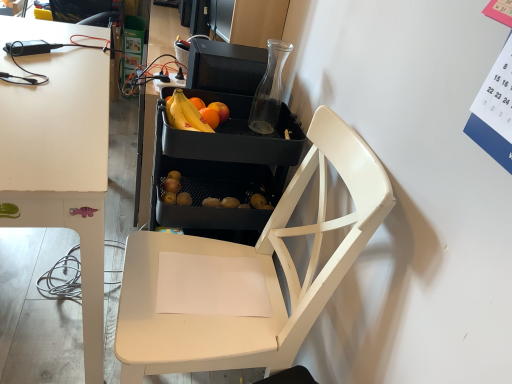
Describe the element at coordinates (223, 144) in the screenshot. This screenshot has width=512, height=384. I see `black plastic tray at center` at that location.

The image size is (512, 384). What do you see at coordinates (61, 167) in the screenshot?
I see `white matte desk at left` at bounding box center [61, 167].

What do you see at coordinates (192, 114) in the screenshot?
I see `matte black fruit at center` at bounding box center [192, 114].

This screenshot has height=384, width=512. Find the location of `black plastic tray at center`. black plastic tray at center is located at coordinates (223, 144).

In order to click on desk below the black plastic tray at center (from the image's perspective) in this screenshot , I will do `click(61, 167)`.

Looking at the image, does black plastic tray at center seem bigger or smaller compared to white matte desk at left?

Considering their sizes, black plastic tray at center takes up more space than white matte desk at left.

Does black plastic tray at center appear on the left side of white matte desk at left?

No, black plastic tray at center is not to the left of white matte desk at left.

Between black plastic tray at center and white matte chair at center, which one has larger width?

white matte chair at center is wider.

Is black plastic tray at center far away from white matte chair at center?

black plastic tray at center is near white matte chair at center, not far away.

From the image's perspective, is black plastic tray at center above or below white matte chair at center?

Based on their image positions, black plastic tray at center is located above white matte chair at center.

From the picture: From a real-world perspective, between black plastic tray at center and white matte chair at center, who is vertically higher?

black plastic tray at center is physically above.

Is matte black fruit at center surrounding white matte desk at left?

No, white matte desk at left is not inside matte black fruit at center.

Looking at this image, relative to white matte desk at left, is matte black fruit at center in front or behind?

matte black fruit at center is behind white matte desk at left.

Looking at this image, how different are the orientations of matte black fruit at center and white matte desk at left in degrees?

The facing directions of matte black fruit at center and white matte desk at left are 25.7 degrees apart.

Which of these two, matte black fruit at center or white matte desk at left, stands taller?

With more height is white matte desk at left.

Considering the sizes of objects matte black fruit at center and white matte chair at center in the image provided, who is smaller, matte black fruit at center or white matte chair at center?

Smaller between the two is matte black fruit at center.

Between matte black fruit at center and white matte chair at center, which one is positioned behind?

Positioned behind is matte black fruit at center.

Is matte black fruit at center situated inside white matte chair at center or outside?

matte black fruit at center lies outside white matte chair at center.

Is matte black fruit at center facing away from white matte chair at center?

No.

Which is behind, point (99, 140) or point (249, 334)?

Positioned behind is point (249, 334).

Do you think white matte desk at left is within white matte chair at center, or outside of it?

white matte desk at left lies outside white matte chair at center.

Would you consider white matte desk at left to be distant from white matte chair at center?

Actually, white matte desk at left and white matte chair at center are a little close together.

Which point is more forward, (261, 351) or (100, 111)?

The point (261, 351) is closer to the camera.

Which of these two, white matte chair at center or white matte desk at left, stands taller?

Standing taller between the two is white matte chair at center.

Could you tell me if white matte chair at center is turned towards white matte desk at left?

Yes.

Which is more to the right, white matte chair at center or white matte desk at left?

white matte chair at center is more to the right.

How many degrees apart are the facing directions of white matte desk at left and matte black fruit at center?

There is a 25.7-degree angle between the facing directions of white matte desk at left and matte black fruit at center.

Locate an element on the screen. desk beneath the matte black fruit at center (from a real-world perspective) is located at coordinates (61, 167).

From the image's perspective, who appears lower, white matte desk at left or matte black fruit at center?

white matte desk at left appears lower in the image.

Based on their positions, is white matte desk at left located to the left or right of matte black fruit at center?

In the image, white matte desk at left appears on the left side of matte black fruit at center.

Where is `desk that appears on the left of black plastic tray at center`? desk that appears on the left of black plastic tray at center is located at coordinates (61, 167).

In the image, there is a black plastic tray at center. Where is `chair below it (from the image's perspective)`? This screenshot has height=384, width=512. chair below it (from the image's perspective) is located at coordinates (245, 274).

Based on their spatial positions, is matte black fruit at center or white matte chair at center closer to black plastic tray at center?

matte black fruit at center lies closer to black plastic tray at center than the other object.

Based on their spatial positions, is matte black fruit at center or black plastic tray at center further from white matte desk at left?

black plastic tray at center is further to white matte desk at left.

Which object lies nearer to the anchor point matte black fruit at center, black plastic tray at center or white matte chair at center?

black plastic tray at center.

Estimate the real-world distances between objects in this image. Which object is further from white matte chair at center, white matte desk at left or black plastic tray at center?

white matte desk at left is further to white matte chair at center.

Which object lies further to the anchor point black plastic tray at center, white matte chair at center or white matte desk at left?

white matte desk at left.

From the image, which object appears to be farther from white matte desk at left, white matte chair at center or black plastic tray at center?

The object further to white matte desk at left is white matte chair at center.

Considering their positions, is white matte desk at left positioned further to matte black fruit at center than black plastic tray at center?

white matte desk at left lies further to matte black fruit at center than the other object.

Looking at the image, which one is located further to white matte chair at center, black plastic tray at center or white matte desk at left?

The object further to white matte chair at center is white matte desk at left.

At what (x,y) coordinates should I click in order to perform the action: click on grapefruit between black plastic tray at center and white matte desk at left from top to bottom. Please return your answer as a coordinate pair (x, y). Looking at the image, I should click on (192, 114).

What are the coordinates of `grapefruit between black plastic tray at center and white matte chair at center in the vertical direction` in the screenshot? It's located at (192, 114).

The image size is (512, 384). What are the coordinates of `desk between black plastic tray at center and white matte chair at center from top to bottom` in the screenshot? It's located at (61, 167).

You are a GUI agent. You are given a task and a screenshot of the screen. Output one action in this format:
    pyautogui.click(x=<x>, y=<y>)
    Task: Click on the grapefruit situated between white matte desk at left and white matte chair at center from left to right
    This screenshot has width=512, height=384.
    Given the screenshot: What is the action you would take?
    (x=192, y=114)